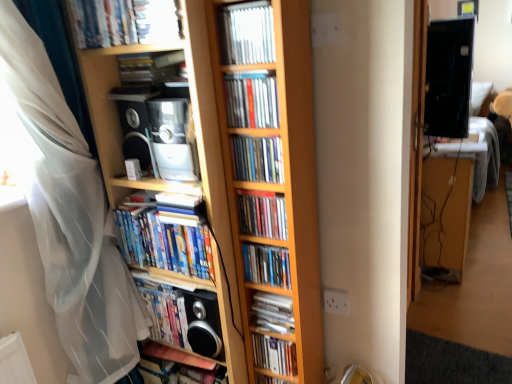
Identify the location of wooden bookcase at center. (232, 171).

Find the location of a particular element. The height and width of the screenshot is (384, 512). matte plastic book at upper left, the 1th book from the top is located at coordinates (124, 22).

This screenshot has width=512, height=384. What do you see at coordinates (273, 312) in the screenshot?
I see `matte plastic dvds at center, marked as the 4th book in a bottom-to-top arrangement` at bounding box center [273, 312].

The height and width of the screenshot is (384, 512). Find the location of `wooden desk at right`. wooden desk at right is located at coordinates (446, 208).

Locate an element on the screen. Image resolution: width=512 pixels, height=384 pixels. white sheer curtain at left is located at coordinates (69, 214).

Where is `wooden bookcase at center`? Image resolution: width=512 pixels, height=384 pixels. wooden bookcase at center is located at coordinates (232, 171).

Could you measure the distance between matte black speaker at center and hardcover books at center, placed as the 6th book when sorted from bottom to top?

A distance of 7.29 inches exists between matte black speaker at center and hardcover books at center, placed as the 6th book when sorted from bottom to top.

Consider the image. Can you confirm if matte black speaker at center is bigger than hardcover books at center, placed as the 6th book when sorted from bottom to top?

Actually, matte black speaker at center might be smaller than hardcover books at center, placed as the 6th book when sorted from bottom to top.

Is matte black speaker at center in front of or behind hardcover books at center, placed as the 6th book when sorted from bottom to top, in the image?

matte black speaker at center is positioned farther from the viewer than hardcover books at center, placed as the 6th book when sorted from bottom to top.

Considering the points (205, 355) and (147, 230), which point is in front, point (205, 355) or point (147, 230)?

The point (147, 230) is closer.

Considering the positions of points (272, 118) and (281, 298), is point (272, 118) closer to camera compared to point (281, 298)?

Yes, it is.

Is matte plastic book at center, marked as the third book in a top-to-bottom arrangement, completely or partially outside of matte plastic dvds at center, the 8th book viewed from the top?

Absolutely, matte plastic book at center, marked as the third book in a top-to-bottom arrangement, is external to matte plastic dvds at center, the 8th book viewed from the top.

How different are the orientations of matte plastic book at center, which appears as the ninth book when ordered from the bottom, and matte plastic dvds at center, the 8th book viewed from the top, in degrees?

0.211 degrees separate the facing orientations of matte plastic book at center, which appears as the ninth book when ordered from the bottom, and matte plastic dvds at center, the 8th book viewed from the top.

Between matte plastic book at center, which appears as the ninth book when ordered from the bottom, and matte plastic dvds at center, marked as the 4th book in a bottom-to-top arrangement, which one has more height?

matte plastic book at center, which appears as the ninth book when ordered from the bottom, is taller.

Can you tell me how much matte black speaker at center and matte plastic book at lower left, which is the third book in bottom-to-top order, differ in facing direction?

The angular difference between matte black speaker at center and matte plastic book at lower left, which is the third book in bottom-to-top order, is 0.0143 degrees.

Does matte black speaker at center have a lesser width compared to matte plastic book at lower left, arranged as the 9th book when viewed from the top?

No.

Measure the distance between matte black speaker at center and matte plastic book at lower left, which is the third book in bottom-to-top order.

The distance of matte black speaker at center from matte plastic book at lower left, which is the third book in bottom-to-top order, is 1.66 inches.

Which point is more distant from viewer, (212, 295) or (212, 341)?

Point (212, 341)

From a real-world perspective, between white sheer curtain at left and metallic silver cd at center, the 10th book in the bottom-to-top sequence, who is vertically higher?

In real-world perspective, metallic silver cd at center, the 10th book in the bottom-to-top sequence, is above.

Is the surface of white sheer curtain at left in direct contact with metallic silver cd at center, acting as the 2th book starting from the top?

No.

Is white sheer curtain at left looking in the opposite direction of metallic silver cd at center, the 10th book in the bottom-to-top sequence?

white sheer curtain at left does not have its back to metallic silver cd at center, the 10th book in the bottom-to-top sequence.

Between white sheer curtain at left and metallic silver cd at center, the 10th book in the bottom-to-top sequence, which one has smaller width?

Thinner between the two is metallic silver cd at center, the 10th book in the bottom-to-top sequence.

Can you tell me how much matte plastic book at center, which appears as the ninth book when ordered from the bottom, and wooden desk at right differ in facing direction?

The angle between the facing direction of matte plastic book at center, which appears as the ninth book when ordered from the bottom, and the facing direction of wooden desk at right is 179 degrees.

Considering the relative positions of matte plastic book at center, which appears as the ninth book when ordered from the bottom, and wooden desk at right in the image provided, is matte plastic book at center, which appears as the ninth book when ordered from the bottom, behind wooden desk at right?

No, matte plastic book at center, which appears as the ninth book when ordered from the bottom, is closer to the camera.

Which is behind, point (271, 99) or point (434, 245)?

Point (434, 245)

Between matte plastic book at center, marked as the third book in a top-to-bottom arrangement, and wooden desk at right, which one has more height?

wooden desk at right is taller.

Considering the relative sizes of matte plastic book at lower left, which is the third book in bottom-to-top order, and hardcover books at center, placed as the 6th book when sorted from bottom to top, in the image provided, is matte plastic book at lower left, which is the third book in bottom-to-top order, shorter than hardcover books at center, placed as the 6th book when sorted from bottom to top,?

No.

From the picture: Considering the relative sizes of matte plastic book at lower left, which is the third book in bottom-to-top order, and hardcover books at center, placed as the 6th book when sorted from bottom to top, in the image provided, is matte plastic book at lower left, which is the third book in bottom-to-top order, wider than hardcover books at center, placed as the 6th book when sorted from bottom to top,?

In fact, matte plastic book at lower left, which is the third book in bottom-to-top order, might be narrower than hardcover books at center, placed as the 6th book when sorted from bottom to top.

Can we say matte plastic book at lower left, which is the third book in bottom-to-top order, lies outside hardcover books at center, placed as the 6th book when sorted from bottom to top?

That's correct, matte plastic book at lower left, which is the third book in bottom-to-top order, is outside of hardcover books at center, placed as the 6th book when sorted from bottom to top.

How different are the orientations of matte plastic book at lower left, arranged as the 9th book when viewed from the top, and hardcover books at center, placed as the 6th book when sorted from bottom to top, in degrees?

The angular difference between matte plastic book at lower left, arranged as the 9th book when viewed from the top, and hardcover books at center, placed as the 6th book when sorted from bottom to top, is 0.765 degrees.

Is black glossy monitor at upper right at the left side of matte plastic books at center, the seventh book from the top?

No, black glossy monitor at upper right is not to the left of matte plastic books at center, the seventh book from the top.

Between black glossy monitor at upper right and matte plastic books at center, the seventh book from the top, which one has less height?

matte plastic books at center, the seventh book from the top.

From a real-world perspective, which object stands above the other?

black glossy monitor at upper right.

Could you tell me if black glossy monitor at upper right is turned towards matte plastic books at center, the seventh book from the top?

No, black glossy monitor at upper right is not facing towards matte plastic books at center, the seventh book from the top.

This screenshot has height=384, width=512. In order to click on speaker below the hardcover books at center, the 6th book positioned from the top (from a real-world perspective) in this screenshot , I will do `click(203, 323)`.

Starting from the matte plastic dvds at center, marked as the 4th book in a bottom-to-top arrangement, which book is the 5th one in front? Please provide its 2D coordinates.

[(252, 100)]

Considering their positions, is matte plastic books at center, the seventh book ordered from the bottom, positioned further to white sheer curtain at left than hardcover book at lower left, placed as the 1th book when sorted from bottom to top?

Based on the image, matte plastic books at center, the seventh book ordered from the bottom, appears to be further to white sheer curtain at left.

Based on their spatial positions, is wooden bookcase at center or white sheer curtain at left further from matte plastic book at center, marked as the third book in a top-to-bottom arrangement?

white sheer curtain at left is further to matte plastic book at center, marked as the third book in a top-to-bottom arrangement.

When comparing their distances from hardcover books at center, placed as the 6th book when sorted from bottom to top, does wooden desk at right or hardcover book at lower left, placed as the 1th book when sorted from bottom to top, seem closer?

Among the two, hardcover book at lower left, placed as the 1th book when sorted from bottom to top, is located nearer to hardcover books at center, placed as the 6th book when sorted from bottom to top.

Looking at the image, which one is located further to matte plastic book at lower center, marked as the second book in a bottom-to-top arrangement, matte plastic book at center, marked as the third book in a top-to-bottom arrangement, or matte plastic books at center, which appears as the eighth book when ordered from the bottom?

Among the two, matte plastic book at center, marked as the third book in a top-to-bottom arrangement, is located further to matte plastic book at lower center, marked as the second book in a bottom-to-top arrangement.

Considering their positions, is hardcover books at center, placed as the 6th book when sorted from bottom to top, positioned closer to matte plastic books at center, acting as the 4th book starting from the top, than matte plastic book at center, which appears as the ninth book when ordered from the bottom?

matte plastic book at center, which appears as the ninth book when ordered from the bottom.

When comparing their distances from matte plastic dvds at center, the 8th book viewed from the top, does metallic silver cd at center, acting as the 2th book starting from the top, or matte plastic book at lower center, marked as the second book in a bottom-to-top arrangement, seem further?

metallic silver cd at center, acting as the 2th book starting from the top, lies further to matte plastic dvds at center, the 8th book viewed from the top, than the other object.

Which object lies further to the anchor point wooden desk at right, matte plastic book at center, which appears as the ninth book when ordered from the bottom, or matte plastic books at center, which appears as the eighth book when ordered from the bottom?

matte plastic book at center, which appears as the ninth book when ordered from the bottom, is further to wooden desk at right.

Considering their positions, is matte plastic dvds at center, the 8th book viewed from the top, positioned closer to hardcover book at lower left, placed as the 1th book when sorted from bottom to top, than metallic silver cd at center, the 10th book in the bottom-to-top sequence?

matte plastic dvds at center, the 8th book viewed from the top.

What are the coordinates of `curtain between matte plastic book at upper left, the 1th book from the top, and matte plastic dvds at center, the 8th book viewed from the top, in the up-down direction` in the screenshot? It's located at (69, 214).

The width and height of the screenshot is (512, 384). I want to click on bookcase that lies between matte plastic book at upper left, the eleventh book ordered from the bottom, and hardcover book at lower left, the 11th book when ordered from top to bottom, from top to bottom, so click(232, 171).

You are a GUI agent. You are given a task and a screenshot of the screen. Output one action in this format:
    pyautogui.click(x=<x>, y=<y>)
    Task: Click on the curtain that lies between matte plastic book at center, marked as the third book in a top-to-bottom arrangement, and hardcover book at lower left, the 11th book when ordered from top to bottom, from top to bottom
    
    Given the screenshot: What is the action you would take?
    pyautogui.click(x=69, y=214)

You are a GUI agent. You are given a task and a screenshot of the screen. Output one action in this format:
    pyautogui.click(x=<x>, y=<y>)
    Task: Click on the computer monitor situated between metallic silver cd at center, the 10th book in the bottom-to-top sequence, and wooden desk at right from left to right
    The height and width of the screenshot is (384, 512).
    Given the screenshot: What is the action you would take?
    pyautogui.click(x=448, y=77)